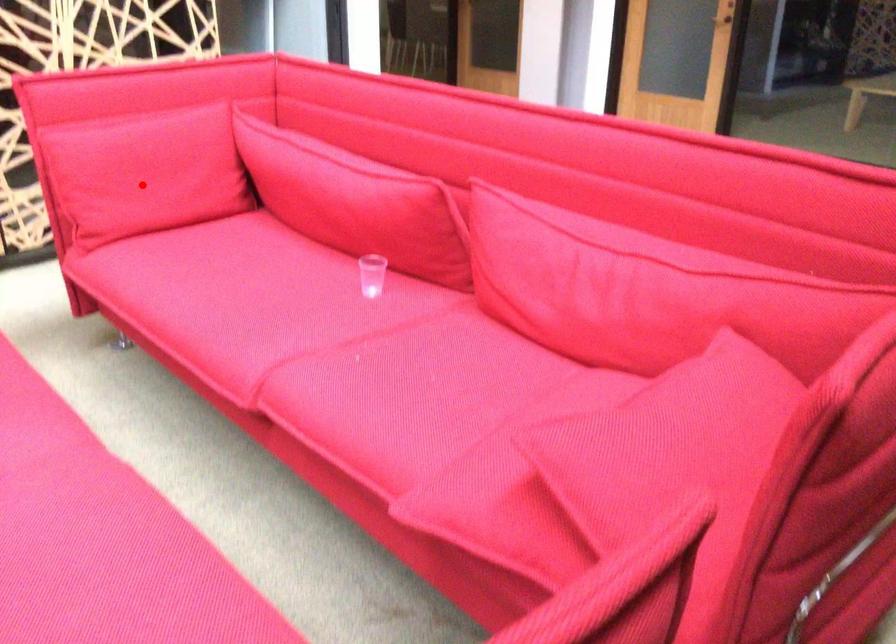
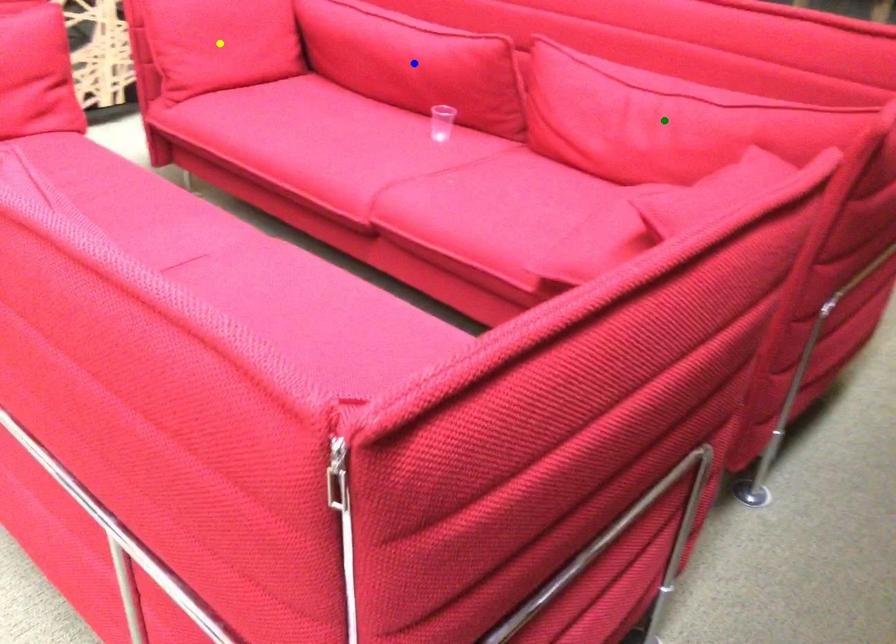
Question: I am providing you with two images of the same scene from different viewpoints. A red point is marked on the first image. You are given multiple points on the second image. In image 2, which mark is for the same physical point as the one in image 1?

Choices:
 (A) yellow point
 (B) green point
 (C) blue point

Answer: (A)